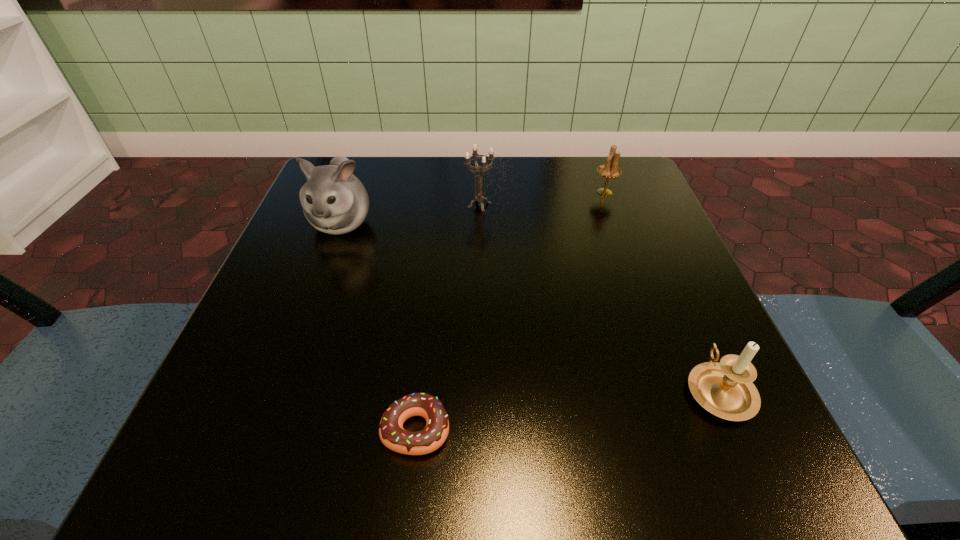
At what (x,y) coordinates should I click in order to perform the action: click on unoccupied position between the hamster and the doughnut. Please return your answer as a coordinate pair (x, y). This screenshot has width=960, height=540. Looking at the image, I should click on (379, 326).

This screenshot has width=960, height=540. Identify the location of object that is the second closest to the doughnut. click(x=334, y=201).

Identify the location of the second closest object to the nearest candle holder. This screenshot has width=960, height=540. (610, 170).

The width and height of the screenshot is (960, 540). What are the coordinates of `the second closest candle holder to the leftmost object` in the screenshot? It's located at (610, 170).

Identify which candle holder is located as the nearest to the fourth object from right to left. Please provide its 2D coordinates. Your answer should be formatted as a tuple, i.e. [(x, y)], where the tuple contains the x and y coordinates of a point satisfying the conditions above.

[(725, 389)]

The height and width of the screenshot is (540, 960). Identify the location of vacant area that satisfies the following two spatial constraints: 1. on the face of the shortest object; 2. on the right side of the hamster. (265, 429).